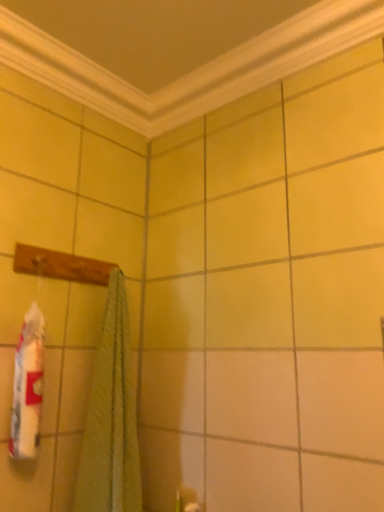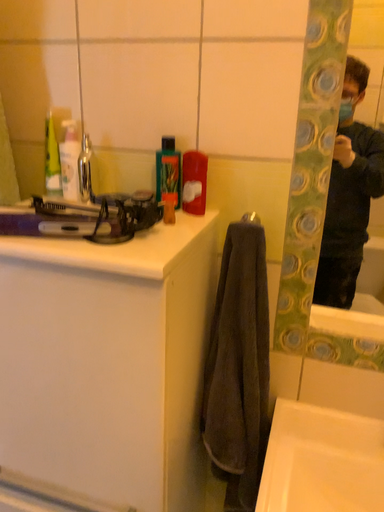
Question: Which way did the camera rotate in the video?

Choices:
 (A) rotated right
 (B) rotated left

Answer: (A)